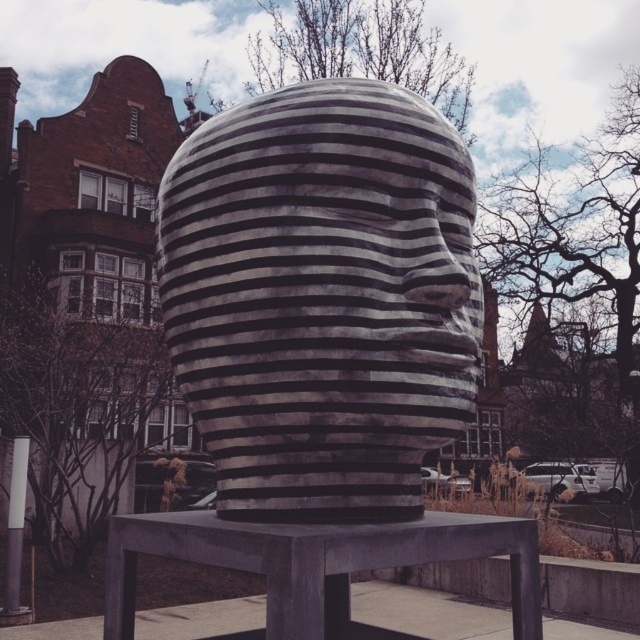
Between marble-like striped bust at center and smooth gray stool at center, which one is positioned lower?

smooth gray stool at center is lower down.

The width and height of the screenshot is (640, 640). Identify the location of marble-like striped bust at center. (321, 298).

This screenshot has width=640, height=640. Identify the location of marble-like striped bust at center. (321, 298).